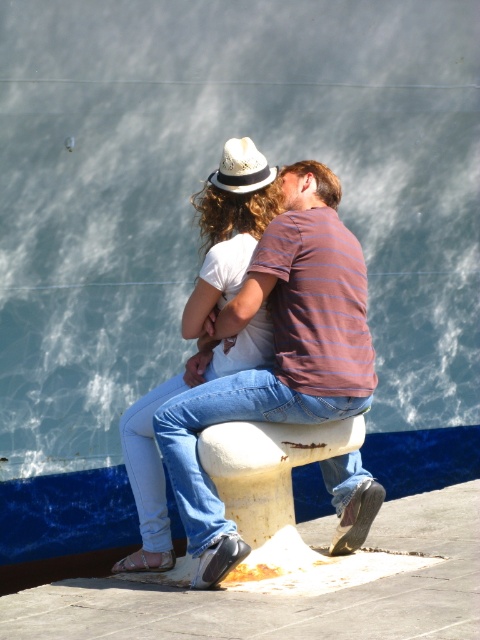
You are a photographer trying to capture both the white matte hat at upper center and the white textured cowboy hat at center in a single shot. Based on their positions, which hat will appear closer to the camera in the photo?

The white matte hat at upper center will appear closer to the camera because it is positioned in front of the white textured cowboy hat at center.

You are a photographer trying to capture a portrait of the two people sitting on the bollard. To ensure the striped cotton shirt at center is perfectly centered in your shot, where should you position your camera relative to the scene?

The striped cotton shirt at center is located at coordinates point (277,355), so you should position your camera directly facing that point to center it in the shot.